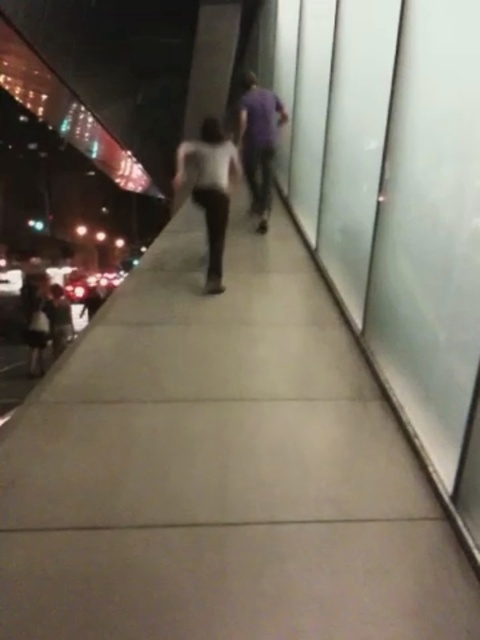
Is point (216, 198) less distant than point (249, 74)?

Yes, point (216, 198) is in front of point (249, 74).

You are a GUI agent. You are given a task and a screenshot of the screen. Output one action in this format:
    pyautogui.click(x=<x>, y=<y>)
    Task: Click on the white matte shirt at center
    
    Given the screenshot: What is the action you would take?
    pyautogui.click(x=210, y=188)

Does point (81, 429) come farther from viewer compared to point (216, 289)?

No.

Can you confirm if gray concrete pavement at center is positioned to the left of white matte shirt at center?

Indeed, gray concrete pavement at center is positioned on the left side of white matte shirt at center.

Identify the location of gray concrete pavement at center. [220, 468].

What are the coordinates of `gray concrete pavement at center` in the screenshot? It's located at (220, 468).

Who is more distant from viewer, (12, 524) or (264, 225)?

Positioned behind is point (264, 225).

Can you confirm if gray concrete pavement at center is bigger than purple matte shirt at center?

Correct, gray concrete pavement at center is larger in size than purple matte shirt at center.

Does point (406, 556) lie in front of point (255, 122)?

Yes, it is in front of point (255, 122).

Locate an element on the screen. gray concrete pavement at center is located at coordinates (220, 468).